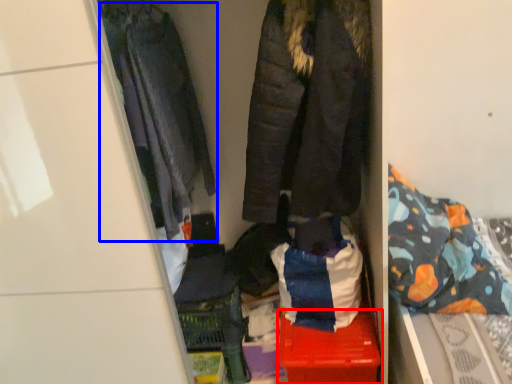
Question: Which point is further to the camera, storage box (highlighted by a red box) or jacket (highlighted by a blue box)?

Choices:
 (A) storage box
 (B) jacket

Answer: (A)